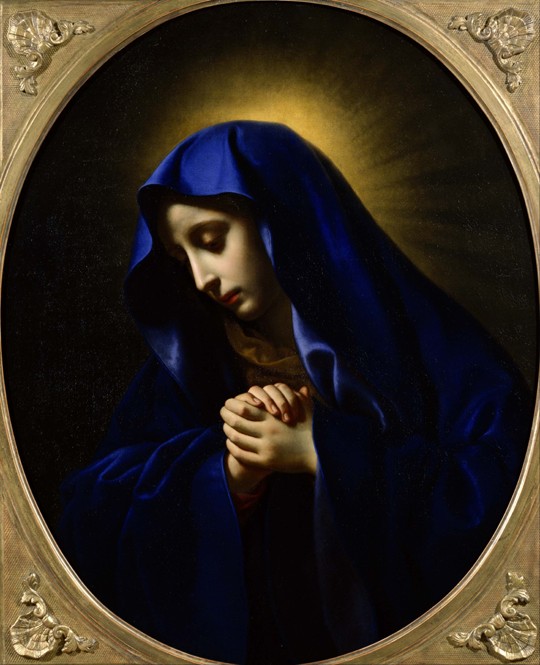
Image resolution: width=540 pixels, height=665 pixels. Identify the location of painting. (297, 314).